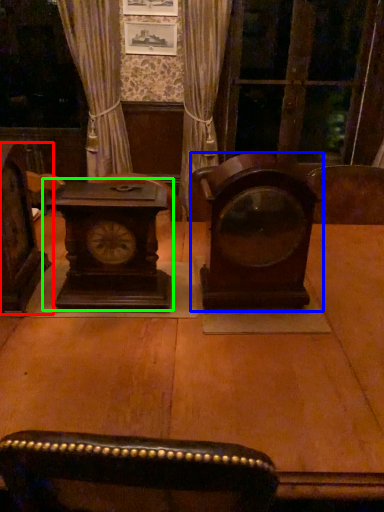
Question: Estimate the real-world distances between objects in this image. Which object is closer to furniture (highlighted by a red box), alarm clock (highlighted by a blue box) or alarm clock (highlighted by a green box)?

Choices:
 (A) alarm clock
 (B) alarm clock

Answer: (B)